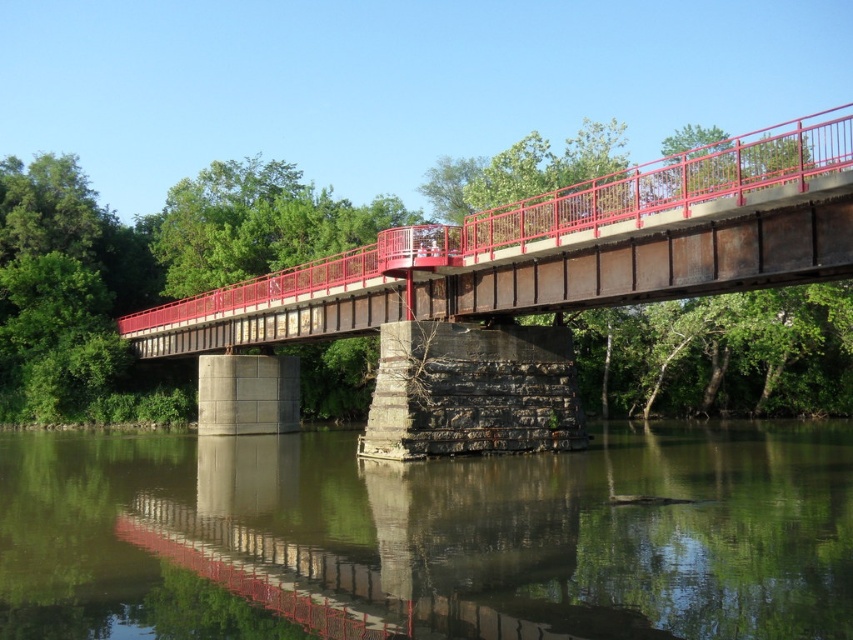
Question: Can you confirm if green reflective water at lower center is positioned to the left of rusty metal bridge at center?

Choices:
 (A) yes
 (B) no

Answer: (A)

Question: Is green reflective water at lower center above rusty metal bridge at center?

Choices:
 (A) yes
 (B) no

Answer: (B)

Question: Which object appears farthest from the camera in this image?

Choices:
 (A) green reflective water at lower center
 (B) rusty metal bridge at center

Answer: (B)

Question: Considering the relative positions of green reflective water at lower center and rusty metal bridge at center in the image provided, where is green reflective water at lower center located with respect to rusty metal bridge at center?

Choices:
 (A) right
 (B) left

Answer: (B)